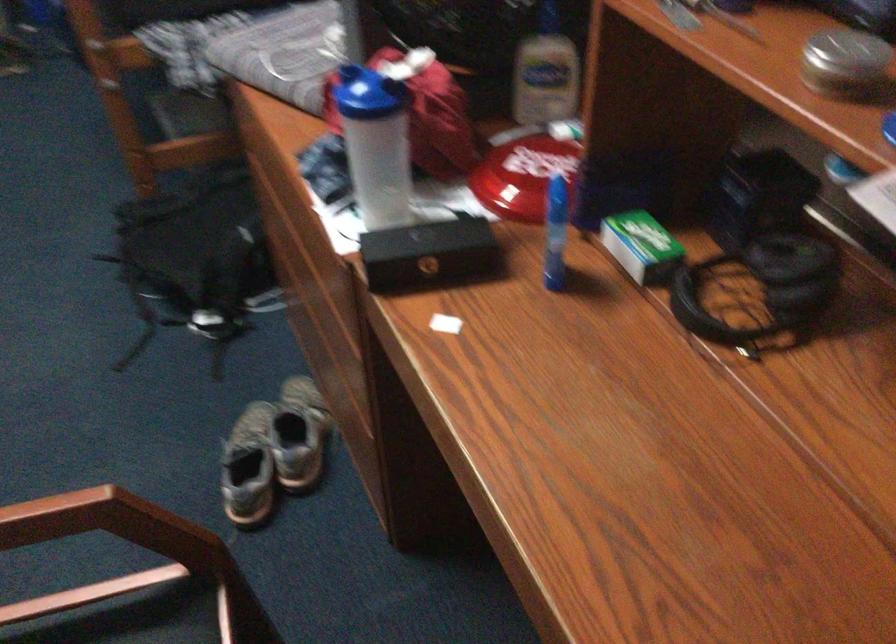
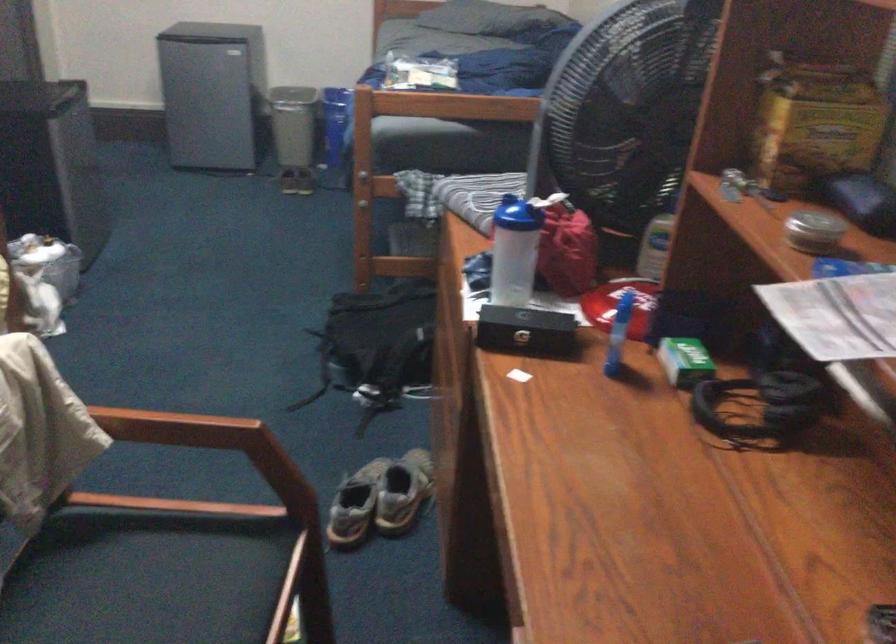
Find the pixel in the second image that matches (x=382, y=147) in the first image.

(513, 251)